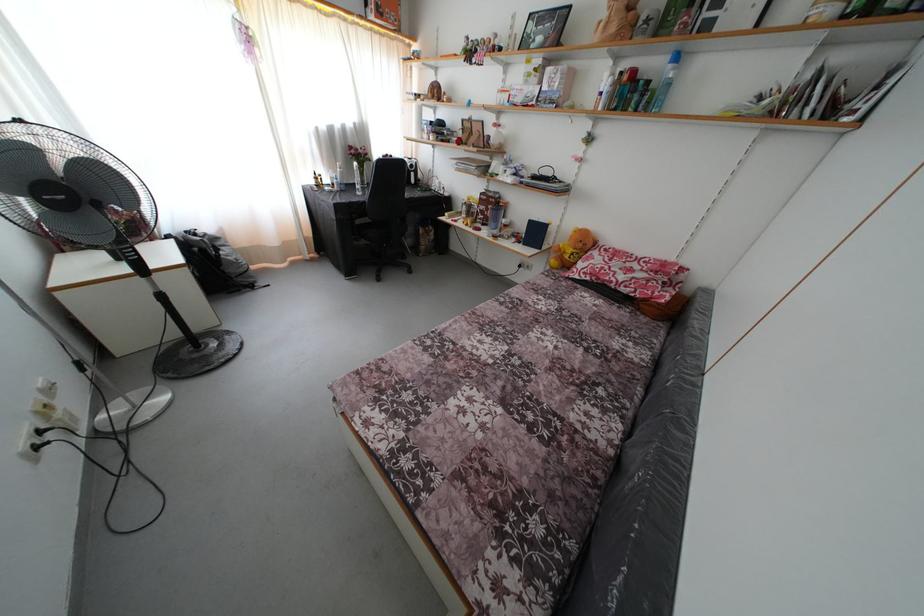
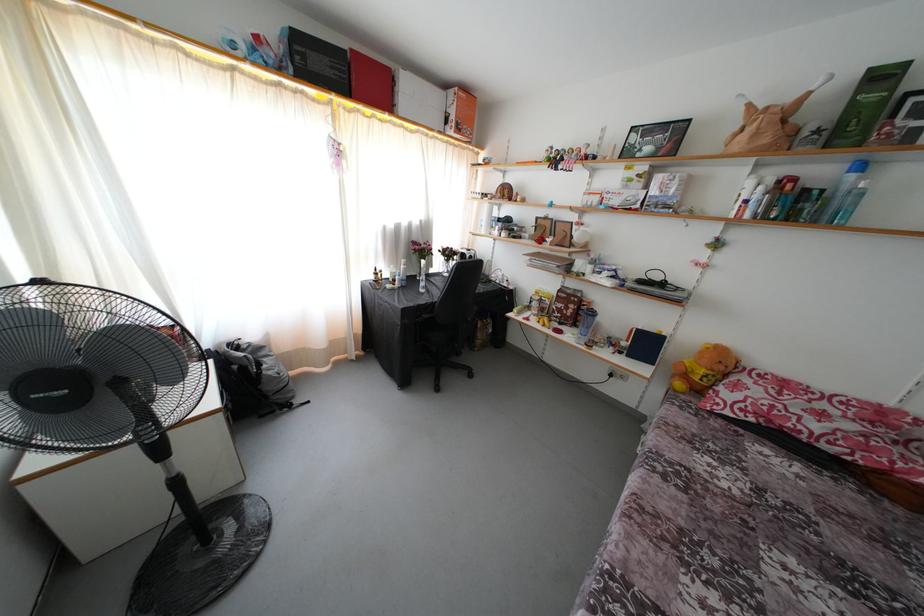
Find the pixel in the second image that matches point 585,251 in the first image.

(726, 373)